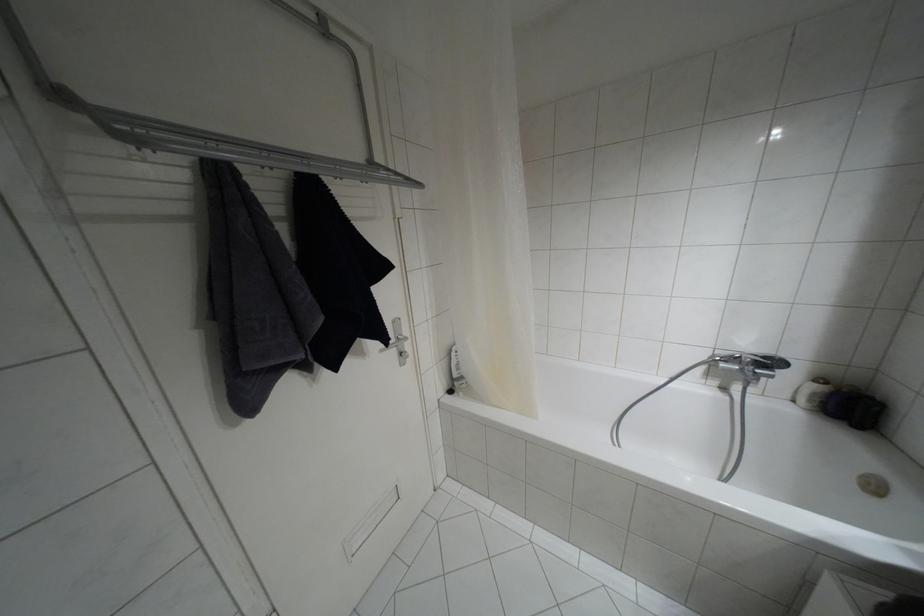
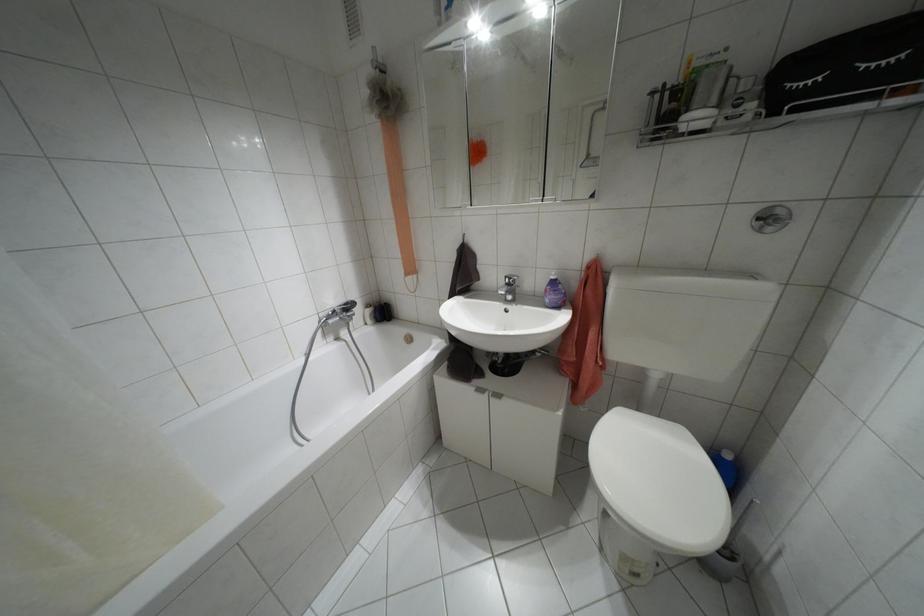
Find the pixel in the second image that matches pixel 820 379 in the first image.

(367, 305)